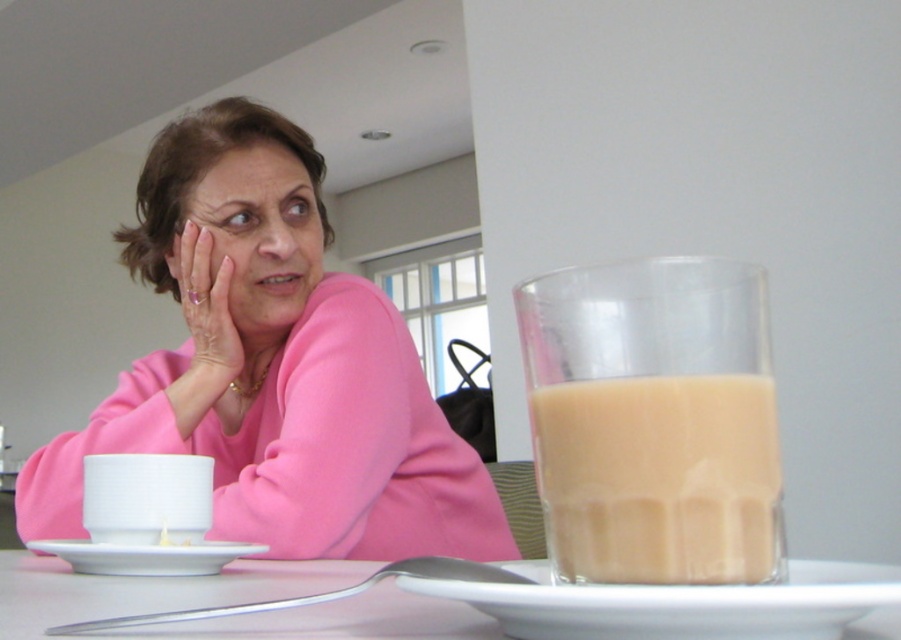
Question: Is pink fabric at center wider than white ceramic cup at lower left?

Choices:
 (A) no
 (B) yes

Answer: (B)

Question: Among these objects, which one is nearest to the camera?

Choices:
 (A) white glossy saucer at lower left
 (B) matte pink sweater at upper left

Answer: (A)

Question: Is translucent glass at right behind white glossy saucer at lower left?

Choices:
 (A) no
 (B) yes

Answer: (A)

Question: Which object appears closest to the camera in this image?

Choices:
 (A) white glossy saucer at lower left
 (B) white ceramic cup at lower left
 (C) pink fabric at center
 (D) matte pink sweater at upper left

Answer: (A)

Question: Is translucent glass at right bigger than white glossy saucer at lower left?

Choices:
 (A) yes
 (B) no

Answer: (B)

Question: Which of the following is the farthest from the observer?

Choices:
 (A) white ceramic cup at lower left
 (B) white glossy saucer at lower left
 (C) translucent glass at right
 (D) white ceramic plate at center

Answer: (A)